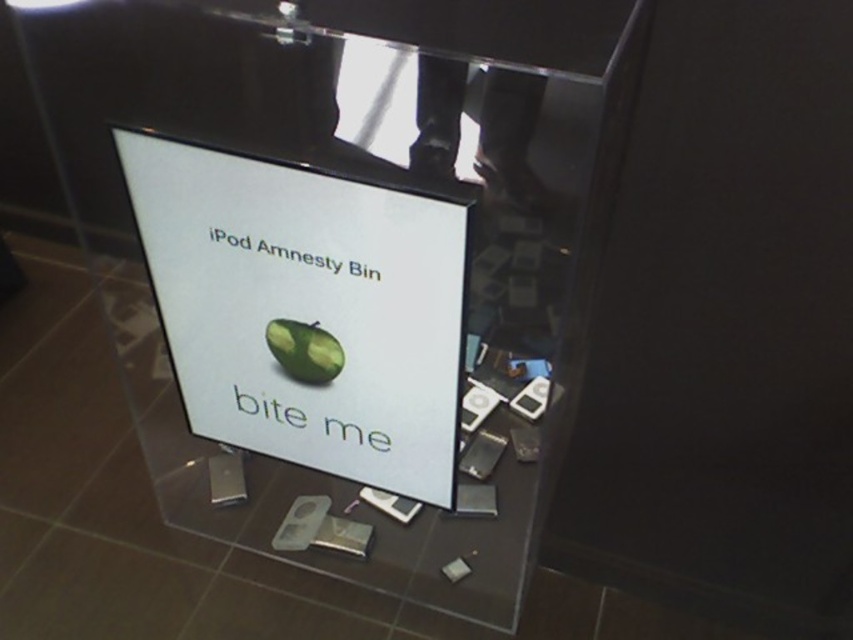
Question: Is white glossy sign at center below green matte avocado at center?

Choices:
 (A) yes
 (B) no

Answer: (B)

Question: Which of the following is the closest to the observer?

Choices:
 (A) (288, 356)
 (B) (241, 340)

Answer: (A)

Question: Which point is farther to the camera?

Choices:
 (A) green matte avocado at center
 (B) white glossy sign at center

Answer: (A)

Question: Is white glossy sign at center further to camera compared to green matte avocado at center?

Choices:
 (A) yes
 (B) no

Answer: (B)

Question: Does white glossy sign at center have a smaller size compared to green matte avocado at center?

Choices:
 (A) yes
 (B) no

Answer: (B)